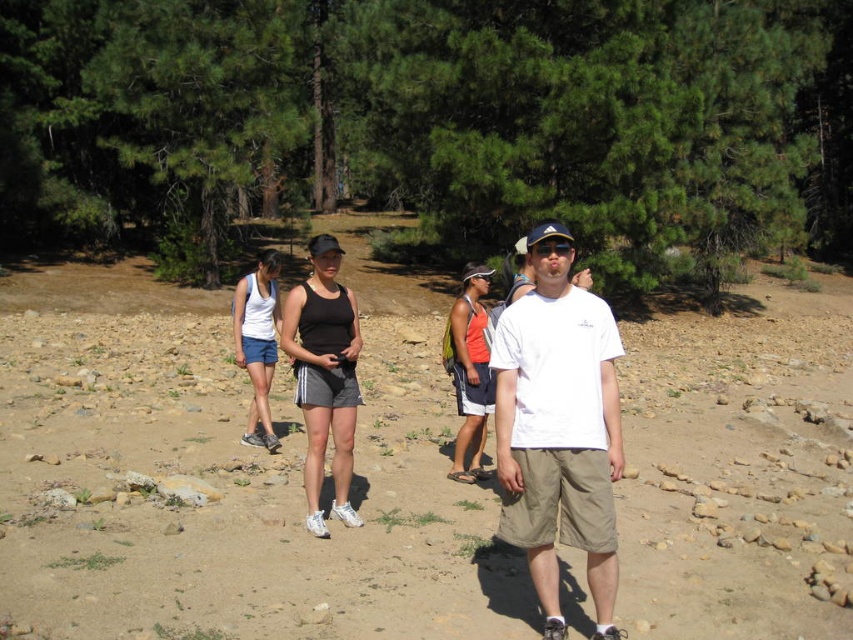
Does orange fabric tank top at center appear on the right side of white fabric tank top at center?

Yes, orange fabric tank top at center is to the right of white fabric tank top at center.

What do you see at coordinates (469, 371) in the screenshot? This screenshot has height=640, width=853. I see `orange fabric tank top at center` at bounding box center [469, 371].

Identify the location of orange fabric tank top at center. This screenshot has height=640, width=853. (469, 371).

Is point (548, 333) more distant than point (276, 276)?

No, (548, 333) is in front of (276, 276).

Who is lower down, white cotton t-shirt at center or white fabric tank top at center?

white cotton t-shirt at center is lower down.

Between point (601, 362) and point (264, 384), which one is positioned behind?

The point (264, 384) is more distant.

Locate an element on the screen. The height and width of the screenshot is (640, 853). white cotton t-shirt at center is located at coordinates (558, 428).

Is point (529, 74) closer to viewer compared to point (334, 506)?

No, (529, 74) is further to viewer.

Is point (16, 173) positioned behind point (339, 349)?

Yes, it is behind point (339, 349).

This screenshot has width=853, height=640. Find the location of `green leafy pine trees at upper center`. green leafy pine trees at upper center is located at coordinates (431, 128).